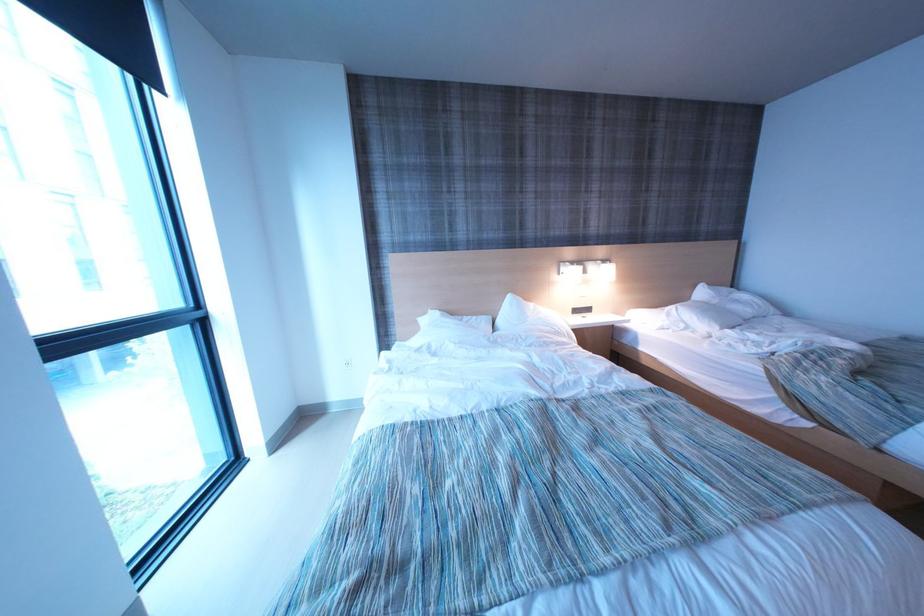
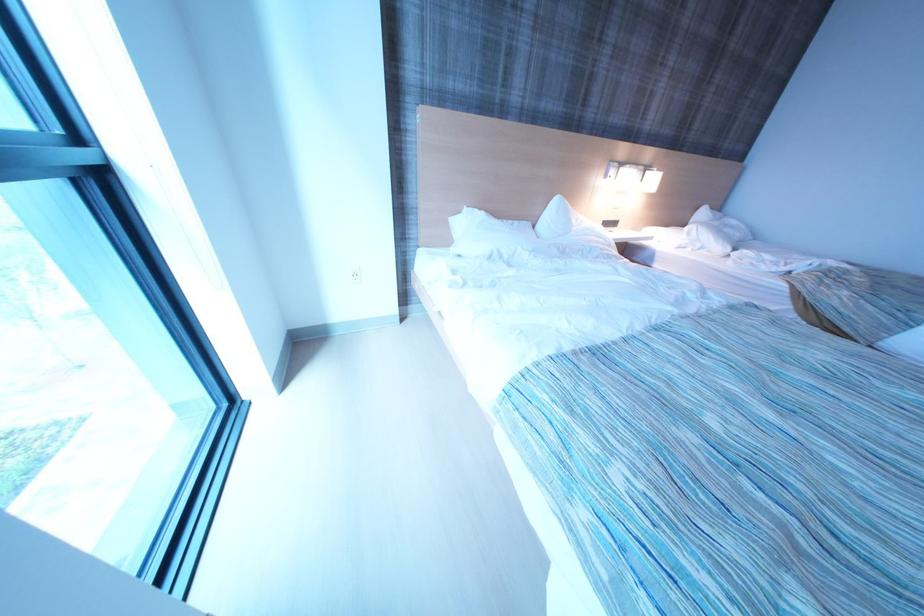
Consider the image. The images are taken continuously from a first-person perspective. In which direction are you moving?

The movement direction of the cameraman is left, forward.